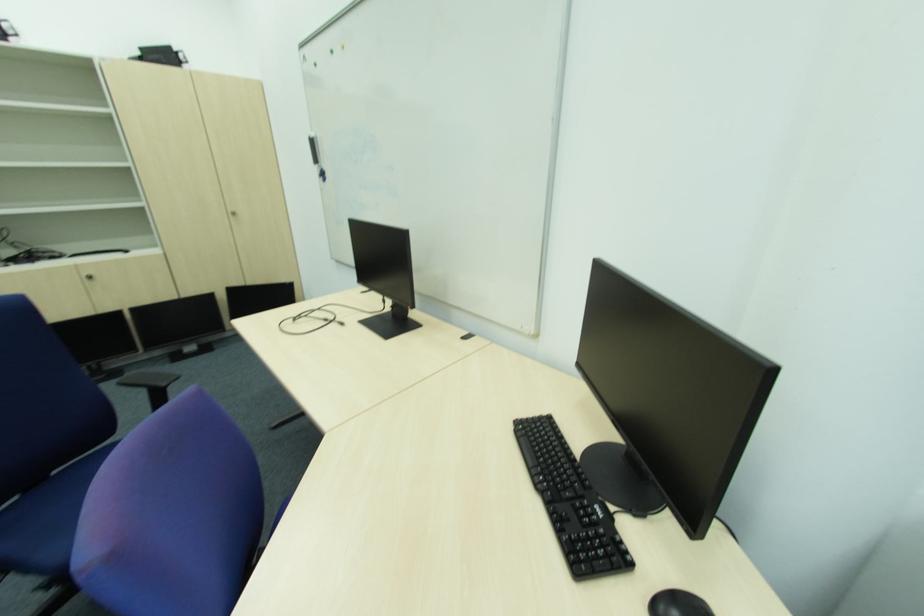
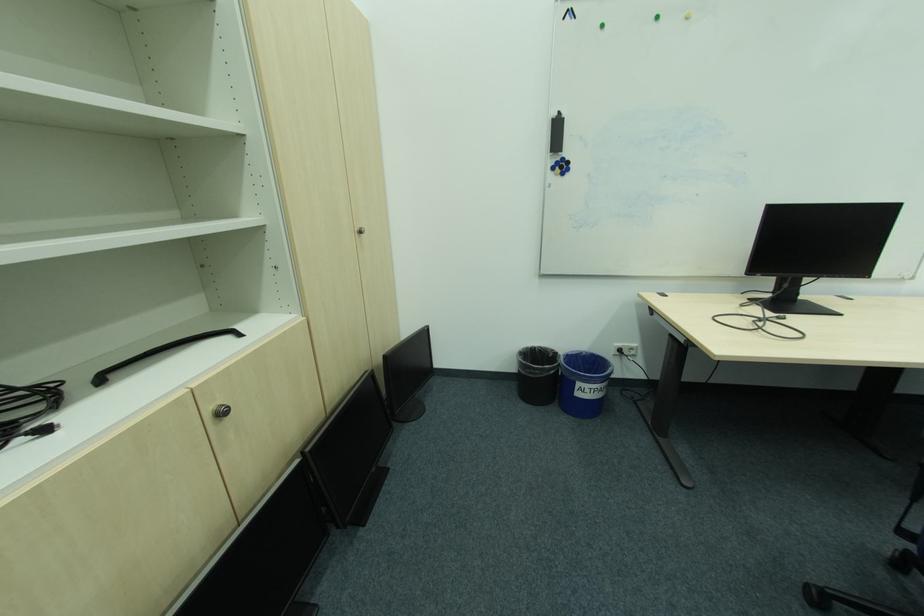
The point at (98, 278) is marked in the first image. Where is the corresponding point in the second image?

(227, 415)